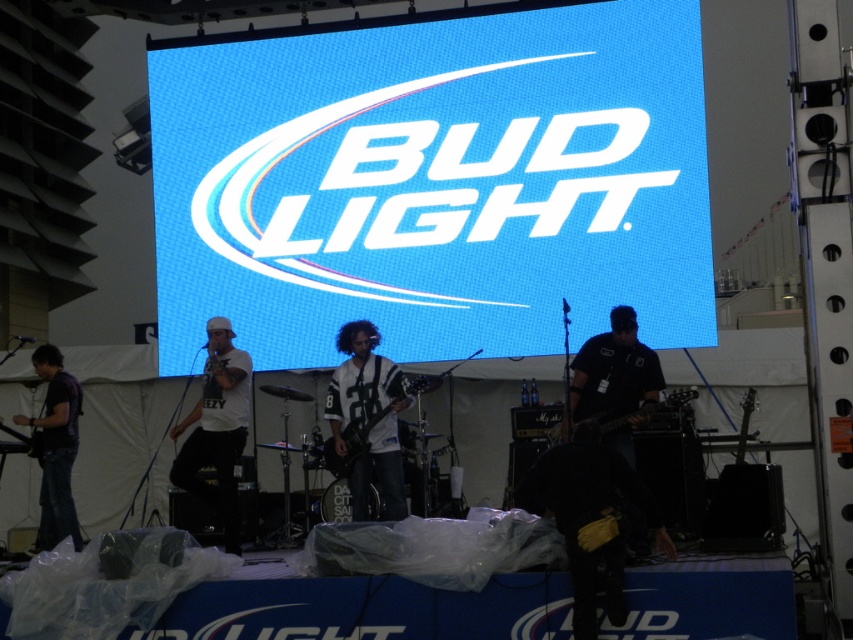
Who is more distant from viewer, (x=61, y=525) or (x=360, y=433)?

Point (x=61, y=525)

Is dark purple shirt at left above black matte electric guitar at center?

No, dark purple shirt at left is not above black matte electric guitar at center.

Where is `dark purple shirt at left`? dark purple shirt at left is located at coordinates (55, 448).

Between white jersey at center and white matte shirt at center, which one is positioned higher?

Positioned higher is white jersey at center.

Locate an element on the screen. The height and width of the screenshot is (640, 853). white jersey at center is located at coordinates (368, 417).

Locate an element on the screen. This screenshot has height=640, width=853. white jersey at center is located at coordinates (368, 417).

Who is more distant from viewer, (573,282) or (337,461)?

The point (573,282) is behind.

Describe the element at coordinates (434, 180) in the screenshot. I see `blue pixelated screen at center` at that location.

Find the location of a particular element. The width and height of the screenshot is (853, 640). blue pixelated screen at center is located at coordinates (434, 180).